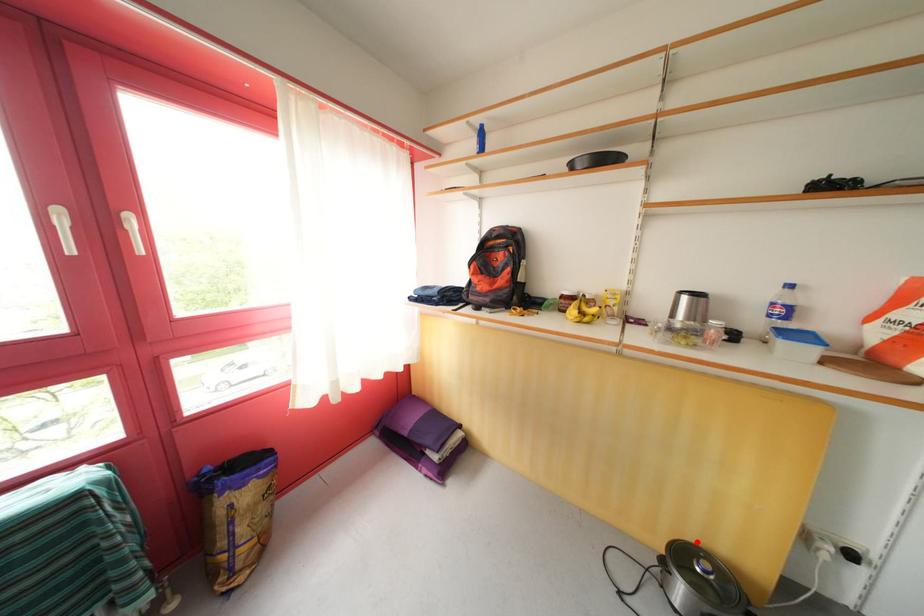
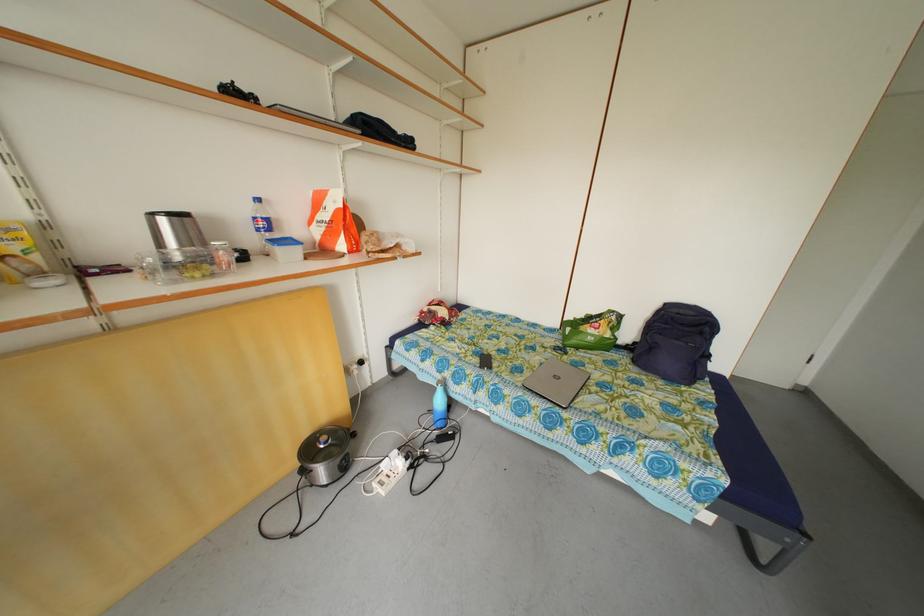
Question: A red point is marked in image1. In image2, is the corresponding 3D point closer to the camera or farther? Reply with the corresponding letter.

Choices:
 (A) The corresponding 3D point is closer.
 (B) The corresponding 3D point is farther.

Answer: (A)